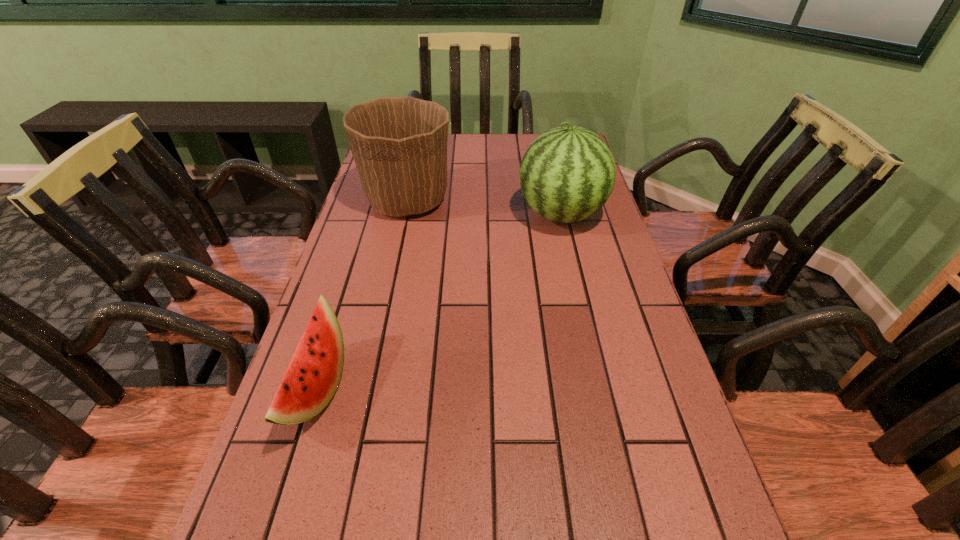
I want to click on object located at the right edge, so tap(567, 174).

In the image, there is a desktop. What are the coordinates of `vacant space at the far edge` in the screenshot? It's located at (508, 165).

At what (x,y) coordinates should I click in order to perform the action: click on vacant region at the left edge of the desktop. Please return your answer as a coordinate pair (x, y). This screenshot has width=960, height=540. Looking at the image, I should click on (346, 242).

Locate an element on the screen. The image size is (960, 540). vacant space at the right edge is located at coordinates (698, 487).

Where is `free space between the left watermelon and the taller watermelon`? This screenshot has width=960, height=540. free space between the left watermelon and the taller watermelon is located at coordinates (438, 302).

The width and height of the screenshot is (960, 540). In order to click on free space between the nearer watermelon and the right watermelon in this screenshot , I will do click(438, 302).

This screenshot has width=960, height=540. In order to click on unoccupied area between the right watermelon and the shortest object in this screenshot , I will do `click(438, 302)`.

The height and width of the screenshot is (540, 960). Find the location of `empty location between the taller watermelon and the nearer watermelon`. empty location between the taller watermelon and the nearer watermelon is located at coordinates (438, 302).

This screenshot has width=960, height=540. Find the location of `vacant area between the flowerpot and the farther watermelon`. vacant area between the flowerpot and the farther watermelon is located at coordinates (484, 207).

Find the location of a particular element. The image size is (960, 540). object that is the second closest to the taller watermelon is located at coordinates (313, 375).